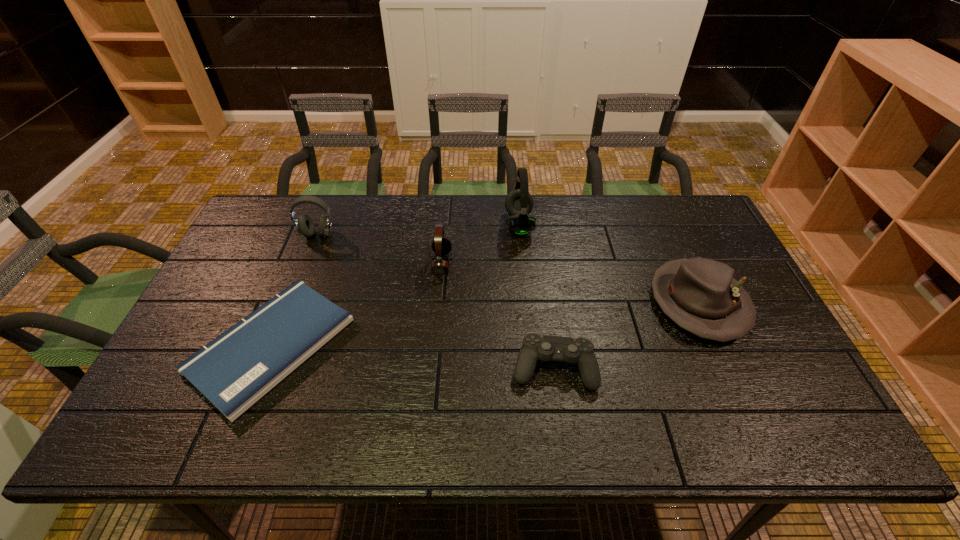
Locate an element on the screen. object that is at the near left corner is located at coordinates (236, 369).

The image size is (960, 540). I want to click on free space at the far edge, so click(415, 219).

At what (x,y) coordinates should I click in order to perform the action: click on vacant area at the near edge. Please return your answer as a coordinate pair (x, y). Image resolution: width=960 pixels, height=540 pixels. Looking at the image, I should click on (676, 420).

In the image, there is a desktop. Where is `vacant region at the left edge`? This screenshot has height=540, width=960. vacant region at the left edge is located at coordinates (252, 303).

Identify the location of vacant space at the near left corner of the desktop. This screenshot has width=960, height=540. (170, 433).

Find the location of a particular element. The height and width of the screenshot is (540, 960). free area in between the shortest object and the tallest object is located at coordinates (395, 285).

Locate an element on the screen. This screenshot has width=960, height=540. vacant point located between the second headset from left to right and the rightmost headset is located at coordinates tap(480, 244).

Image resolution: width=960 pixels, height=540 pixels. Identify the location of free space between the shortest object and the fourth object from right to left. coord(356,304).

Where is `unoccupied position between the second headset from right to left and the leftmost headset`? unoccupied position between the second headset from right to left and the leftmost headset is located at coordinates (379, 249).

Where is `free space between the leftmost headset and the tallest object`? free space between the leftmost headset and the tallest object is located at coordinates (419, 230).